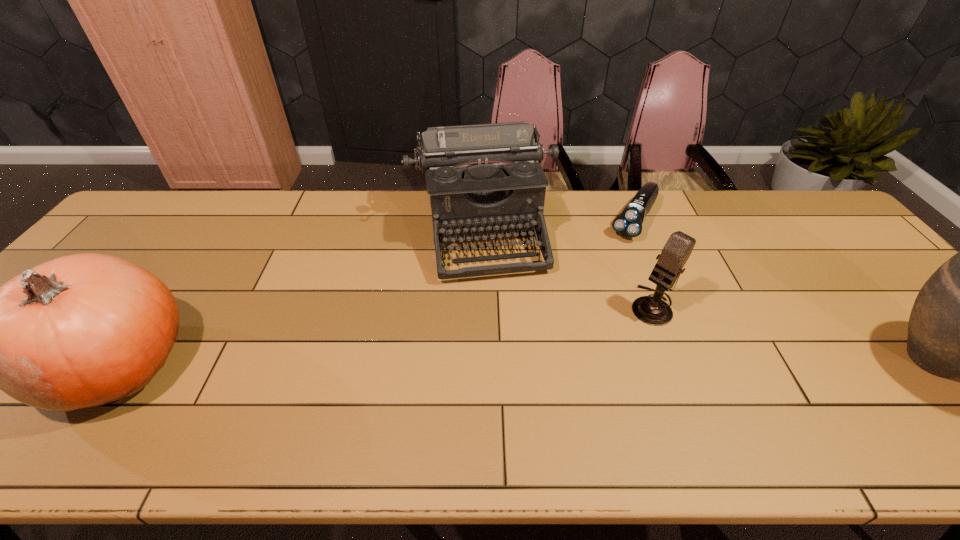
You are a GUI agent. You are given a task and a screenshot of the screen. Output one action in this format:
    pyautogui.click(x=<x>, y=<y>)
    Task: Click on the vacant area between the microphone and the shortest object
    The height and width of the screenshot is (540, 960).
    Given the screenshot: What is the action you would take?
    pyautogui.click(x=642, y=263)

This screenshot has width=960, height=540. In order to click on unoccupied position between the second object from left to right and the microphone in this screenshot , I will do `click(566, 268)`.

Find the location of a particular element. unoccupied position between the fourth object from right to left and the microphone is located at coordinates (566, 268).

Point out which object is positioned as the nearest to the microphone. Please provide its 2D coordinates. Your answer should be formatted as a tuple, i.e. [(x, y)], where the tuple contains the x and y coordinates of a point satisfying the conditions above.

[(482, 179)]

Find the location of a particular element. the closest object to the rightmost object is located at coordinates (652, 310).